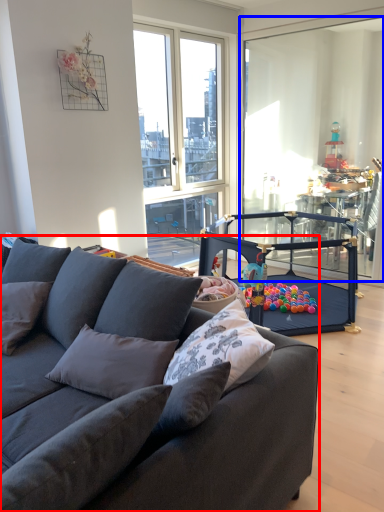
Question: Among these objects, which one is nearest to the camera, studio couch (highlighted by a red box) or screen door (highlighted by a blue box)?

Choices:
 (A) studio couch
 (B) screen door

Answer: (A)